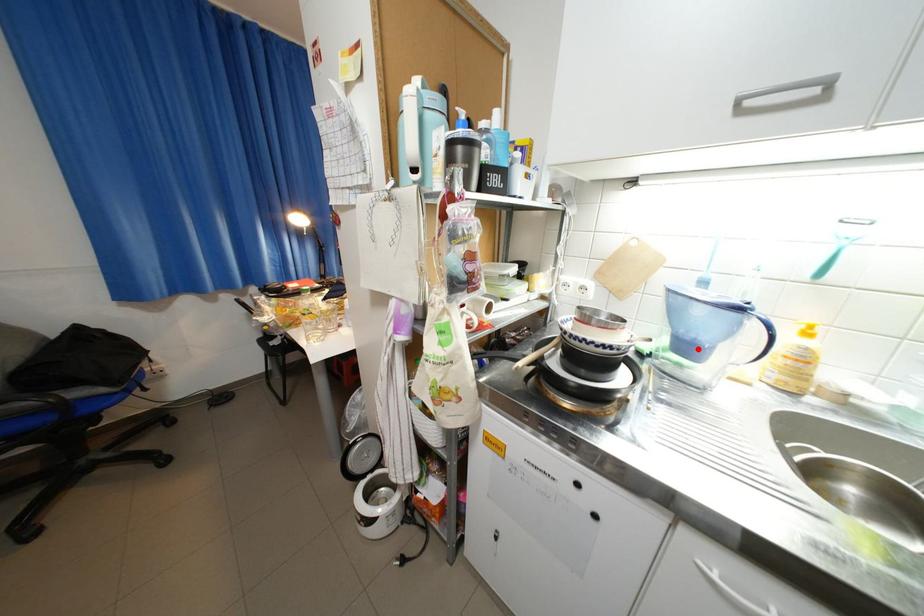
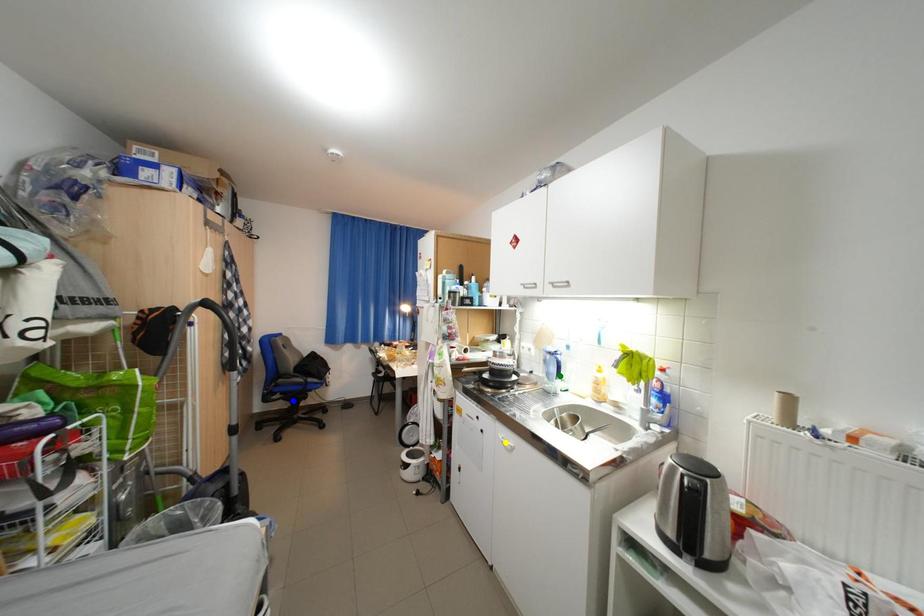
Question: I am providing you with two images of the same scene from different viewpoints. A red point is marked on the first image. You are given multiple points on the second image. Which point in image 2 is actually the same real-world point as the red point in image 1?

Choices:
 (A) green point
 (B) blue point
 (C) yellow point

Answer: (A)